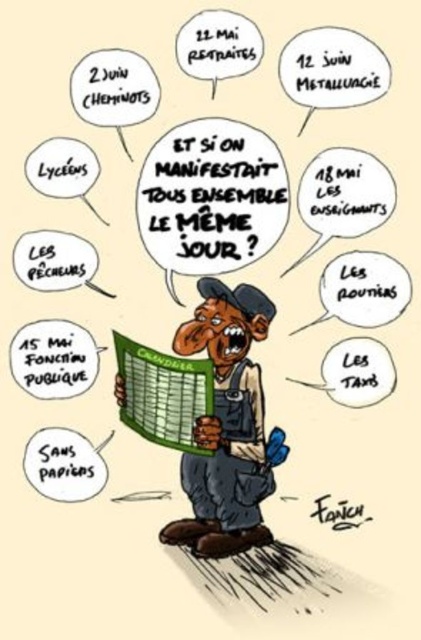
You are an artist analyzing the cartoon and need to determine the distance between the two overalls. Given that the minimum distance for distinguishable features in this style is 2.3 centimeters, can the matte overalls at center and the dark blue overalls at center be clearly distinguished?

The matte overalls at center is 2.47 centimeters from dark blue overalls at center, which exceeds the minimum distinguishable distance of 2.3 centimeters. Therefore, they can be clearly distinguished.

You are an observer looking at the cartoon. You notice two pairs of overalls worn by the worker. Which pair of overalls, matte overalls at center or dark blue overalls at center, appears larger in height?

The matte overalls at center is taller than dark blue overalls at center.